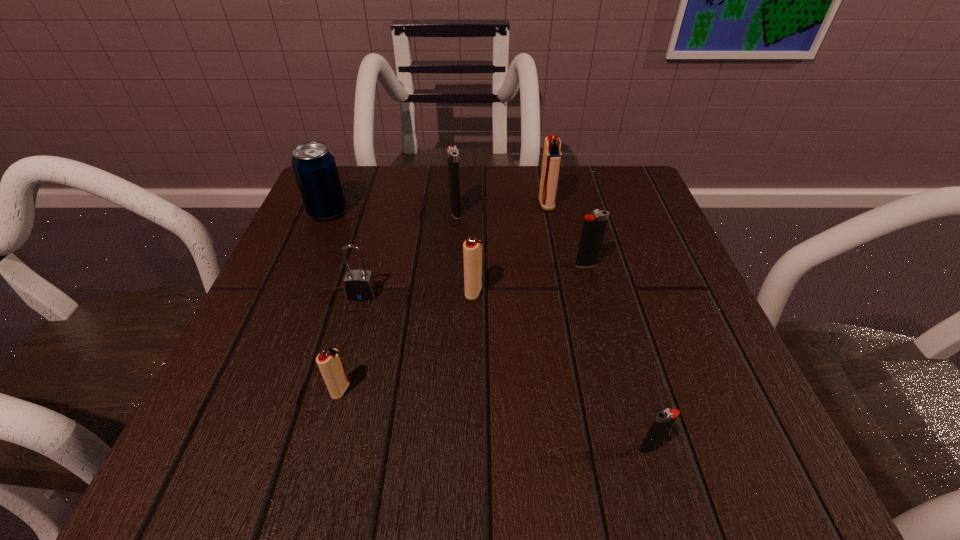
Find the location of a particular element. The height and width of the screenshot is (540, 960). red igniter identified as the second closest to the leftmost red igniter is located at coordinates (552, 156).

At what (x,y) coordinates should I click in order to perform the action: click on black igniter that is the second nearest to the leftmost igniter. Please return your answer as a coordinate pair (x, y). This screenshot has width=960, height=540. Looking at the image, I should click on (452, 152).

The height and width of the screenshot is (540, 960). I want to click on black igniter that is the second closest one to the smallest black igniter, so click(x=452, y=152).

At what (x,y) coordinates should I click in order to perform the action: click on vacant region that satisfies the following two spatial constraints: 1. on the front side of the nearest igniter; 2. on the left side of the fourth igniter from left to right. Please return your answer as a coordinate pair (x, y). The height and width of the screenshot is (540, 960). Looking at the image, I should click on (592, 448).

Where is `free location that satisfies the following two spatial constraints: 1. on the front side of the nearest object; 2. on the right side of the fourth object from right to left`? This screenshot has width=960, height=540. free location that satisfies the following two spatial constraints: 1. on the front side of the nearest object; 2. on the right side of the fourth object from right to left is located at coordinates (471, 448).

The width and height of the screenshot is (960, 540). Find the location of `vacant position in the image that satisfies the following two spatial constraints: 1. on the back side of the leftmost object; 2. on the right side of the biggest black igniter`. vacant position in the image that satisfies the following two spatial constraints: 1. on the back side of the leftmost object; 2. on the right side of the biggest black igniter is located at coordinates (327, 212).

Find the location of a particular element. free space that satisfies the following two spatial constraints: 1. on the front side of the fifth farthest igniter; 2. on the right side of the soda can is located at coordinates tap(252, 390).